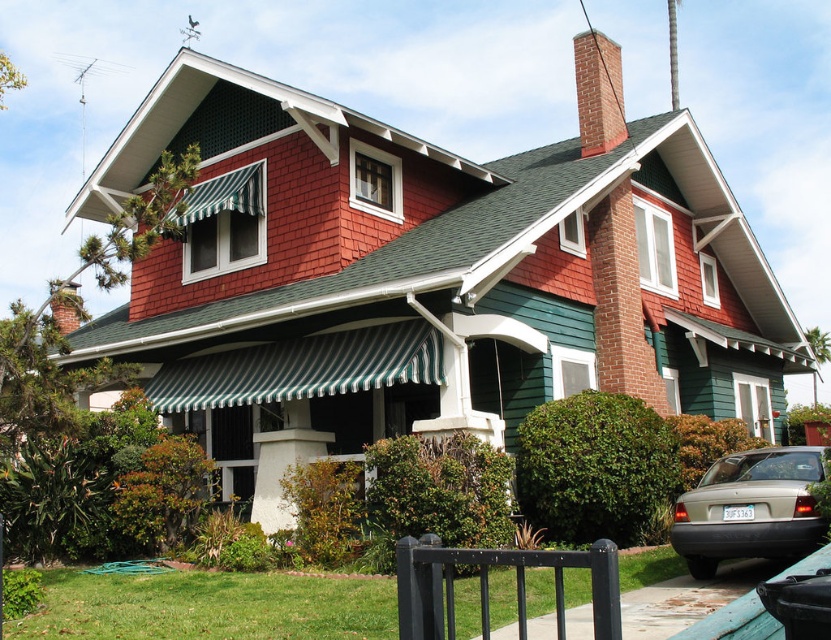
Can you confirm if matte gray sedan at lower right is taller than brick chimney at upper center?

In fact, matte gray sedan at lower right may be shorter than brick chimney at upper center.

Is the position of matte gray sedan at lower right more distant than that of brick chimney at upper center?

No, matte gray sedan at lower right is in front of brick chimney at upper center.

Identify the location of matte gray sedan at lower right. (750, 508).